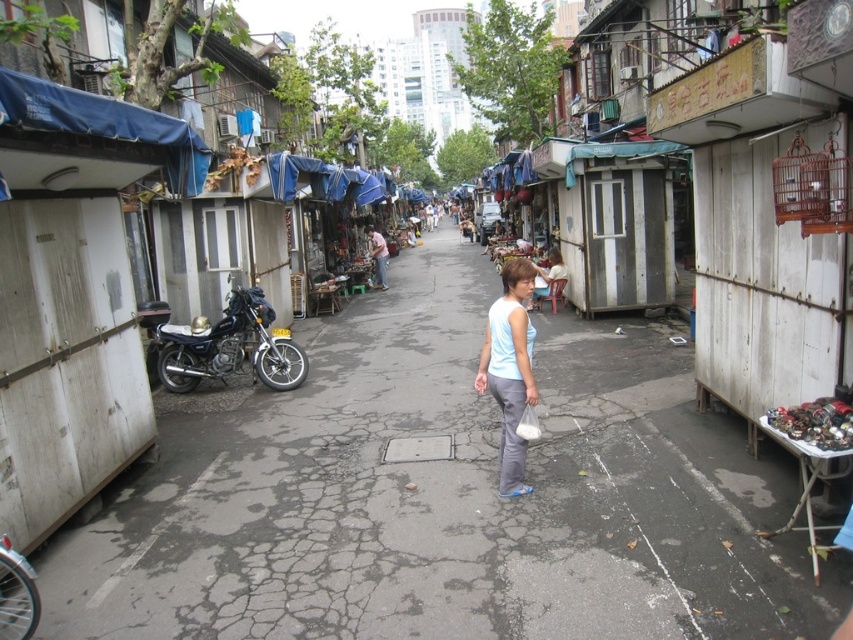
Looking at this image, does shiny blue motorcycle at left appear on the right side of light blue fabric at center?

In fact, shiny blue motorcycle at left is to the left of light blue fabric at center.

This screenshot has height=640, width=853. In order to click on shiny blue motorcycle at left in this screenshot , I will do `click(229, 346)`.

Can you confirm if gray cracked pavement at center is wider than light blue fabric at center?

Yes.

Can you confirm if gray cracked pavement at center is smaller than light blue fabric at center?

Actually, gray cracked pavement at center might be larger than light blue fabric at center.

Is point (793, 552) positioned behind point (531, 381)?

No, (793, 552) is closer to viewer.

Locate an element on the screen. The width and height of the screenshot is (853, 640). gray cracked pavement at center is located at coordinates (445, 497).

Who is positioned more to the right, gray cracked pavement at center or shiny blue motorcycle at left?

gray cracked pavement at center is more to the right.

Is gray cracked pavement at center to the left of shiny blue motorcycle at left from the viewer's perspective?

In fact, gray cracked pavement at center is to the right of shiny blue motorcycle at left.

The height and width of the screenshot is (640, 853). What do you see at coordinates (445, 497) in the screenshot? I see `gray cracked pavement at center` at bounding box center [445, 497].

Identify the location of gray cracked pavement at center. (445, 497).